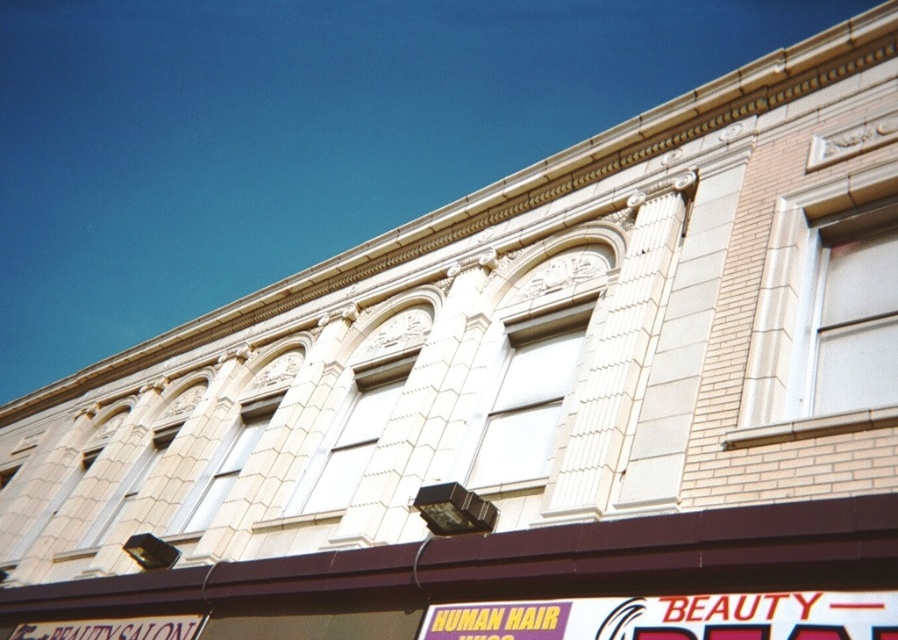
You are a delivery person trying to find the entrance to the building. You see the brown matte awning at center and the yellow matte sign at lower center. Which object is wider from your perspective?

The brown matte awning at center is wider than the yellow matte sign at lower center according to the description.

You are standing in front of the building shown in the image. There is a point marked at coordinates (522, 561). Which object is located at that point?

The brown matte awning at center is located at point (522, 561).

You are standing in front of the building and want to locate two specific points on the facade. The first point is at coordinates point (773,532) and the second is at point (456,624). Which of these points is closer to you?

Point (773,532) is in front of point (456,624), so it is closer to you.